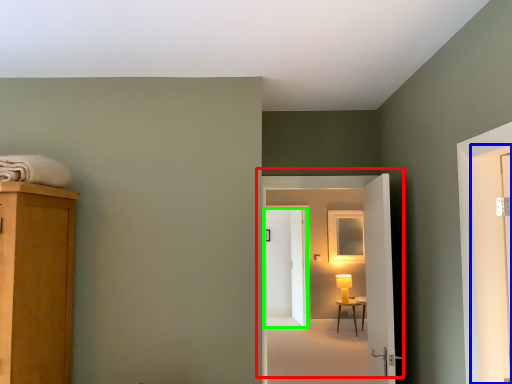
Question: Estimate the real-world distances between objects in this image. Which object is farther from door (highlighted by a red box), screen door (highlighted by a blue box) or door (highlighted by a green box)?

Choices:
 (A) screen door
 (B) door

Answer: (B)